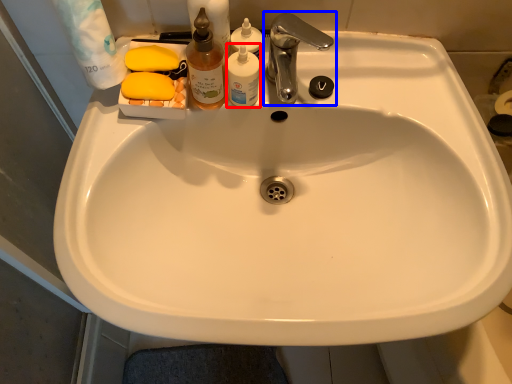
Question: Which point is further to the camera, toiletry (highlighted by a red box) or tap (highlighted by a blue box)?

Choices:
 (A) toiletry
 (B) tap

Answer: (A)